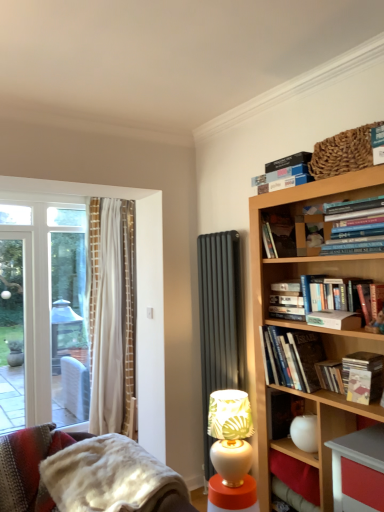
Question: From the image's perspective, is hardcover book at upper right, which is counted as the first book, starting from the bottom, located beneath fuzzy woolen blanket at lower left?

Choices:
 (A) yes
 (B) no

Answer: (B)

Question: Considering the relative positions of hardcover book at upper right, placed as the 5th book when sorted from top to bottom, and fuzzy woolen blanket at lower left in the image provided, is hardcover book at upper right, placed as the 5th book when sorted from top to bottom, in front of fuzzy woolen blanket at lower left?

Choices:
 (A) yes
 (B) no

Answer: (B)

Question: Is hardcover book at upper right, placed as the 5th book when sorted from top to bottom, further to the viewer compared to fuzzy woolen blanket at lower left?

Choices:
 (A) yes
 (B) no

Answer: (A)

Question: Is fuzzy woolen blanket at lower left located within hardcover book at upper right, which is counted as the first book, starting from the bottom?

Choices:
 (A) yes
 (B) no

Answer: (B)

Question: From the image's perspective, is hardcover book at upper right, which is counted as the first book, starting from the bottom, on top of fuzzy woolen blanket at lower left?

Choices:
 (A) no
 (B) yes

Answer: (B)

Question: Is matte yellow paperback book at upper right, arranged as the 3th paperback book when ordered from the bottom, spatially inside hardcover book at upper right, placed as the 5th book when sorted from top to bottom, or outside of it?

Choices:
 (A) outside
 (B) inside

Answer: (A)

Question: Considering the positions of matte yellow paperback book at upper right, which appears as the 3th paperback book when viewed from the top, and hardcover book at upper right, which is counted as the first book, starting from the bottom, in the image, is matte yellow paperback book at upper right, which appears as the 3th paperback book when viewed from the top, wider or thinner than hardcover book at upper right, which is counted as the first book, starting from the bottom,?

Choices:
 (A) wide
 (B) thin

Answer: (B)

Question: From a real-world perspective, is matte yellow paperback book at upper right, arranged as the 3th paperback book when ordered from the bottom, positioned above or below hardcover book at upper right, which is counted as the first book, starting from the bottom?

Choices:
 (A) above
 (B) below

Answer: (B)

Question: Is matte yellow paperback book at upper right, arranged as the 3th paperback book when ordered from the bottom, in front of or behind hardcover book at upper right, which is counted as the first book, starting from the bottom, in the image?

Choices:
 (A) behind
 (B) front

Answer: (B)

Question: From their relative heights in the image, would you say white glossy side table at lower center is taller or shorter than hardcover book at upper right, the 1th paperback book positioned from the top?

Choices:
 (A) short
 (B) tall

Answer: (B)

Question: From a real-world perspective, relative to hardcover book at upper right, which is the 5th paperback book in bottom-to-top order, is white glossy side table at lower center vertically above or below?

Choices:
 (A) below
 (B) above

Answer: (A)

Question: Is white glossy side table at lower center wider or thinner than hardcover book at upper right, the 1th paperback book positioned from the top?

Choices:
 (A) wide
 (B) thin

Answer: (A)

Question: Is white glossy side table at lower center spatially inside hardcover book at upper right, the 1th paperback book positioned from the top, or outside of it?

Choices:
 (A) inside
 (B) outside

Answer: (B)

Question: From a real-world perspective, is hardcover book at center-right, arranged as the first paperback book when ordered from the bottom, positioned above or below white glossy table lamp at lower center?

Choices:
 (A) below
 (B) above

Answer: (B)

Question: Considering the positions of hardcover book at center-right, which is the 5th paperback book from top to bottom, and white glossy table lamp at lower center in the image, is hardcover book at center-right, which is the 5th paperback book from top to bottom, bigger or smaller than white glossy table lamp at lower center?

Choices:
 (A) small
 (B) big

Answer: (A)